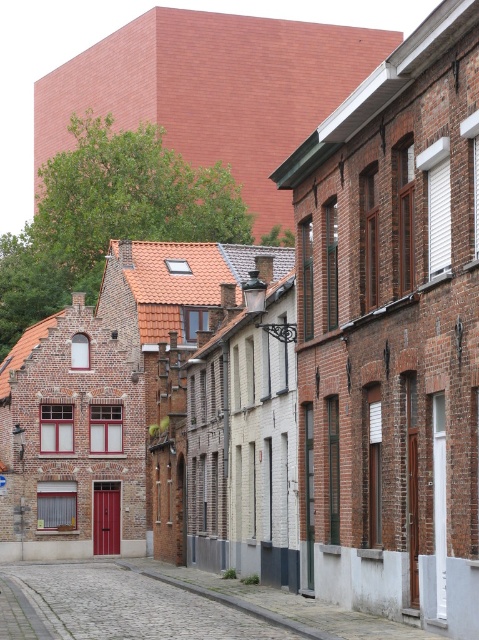
Is point (421, 262) farther from camera compared to point (138, 579)?

That is False.

Is the position of brick building at center less distant than that of cobblestone street at center?

Yes.

Is point (435, 227) closer to viewer compared to point (20, 577)?

That is True.

Image resolution: width=479 pixels, height=640 pixels. I want to click on brick building at center, so click(x=392, y=332).